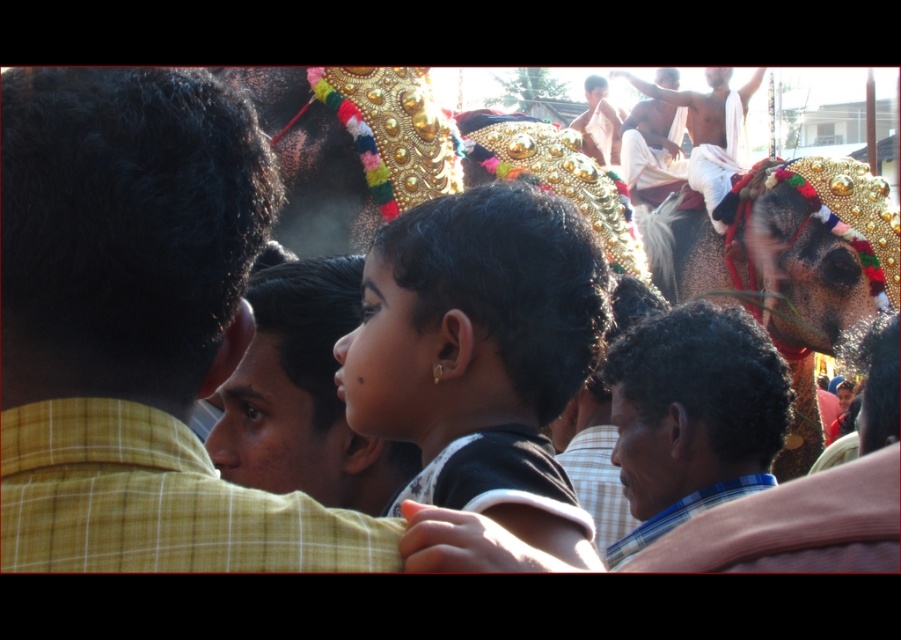
Does light brown plaid shirt at center lie in front of dark skin man at upper right?

Yes, it is in front of dark skin man at upper right.

Describe the element at coordinates (302, 396) in the screenshot. I see `light brown plaid shirt at center` at that location.

Identify the location of light brown plaid shirt at center. (302, 396).

Measure the distance between black matte hair at center and shiny gold ornament at upper right.

black matte hair at center is 190.92 feet from shiny gold ornament at upper right.

Does black matte hair at center have a lesser width compared to shiny gold ornament at upper right?

Incorrect, black matte hair at center's width is not less than shiny gold ornament at upper right's.

I want to click on black matte hair at center, so 481,355.

Is black matte hair at center smaller than light brown skin at upper center?

Indeed, black matte hair at center has a smaller size compared to light brown skin at upper center.

Is black matte hair at center further to camera compared to light brown skin at upper center?

No, it is not.

Between point (517, 284) and point (617, 148), which one is positioned in front?

Point (517, 284)

At what (x,y) coordinates should I click in order to perform the action: click on black matte hair at center. Please return your answer as a coordinate pair (x, y). This screenshot has height=640, width=901. Looking at the image, I should click on (481, 355).